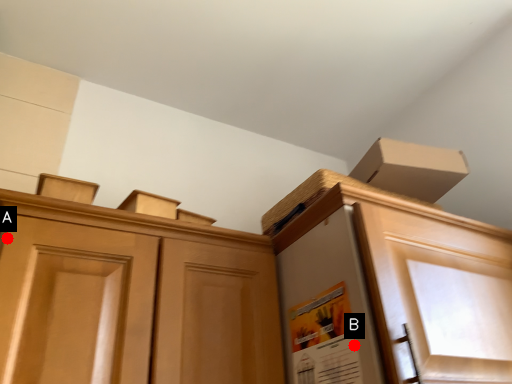
Question: Two points are circled on the image, labeled by A and B beside each circle. Which point is further to the camera?

Choices:
 (A) A is further
 (B) B is further

Answer: (A)